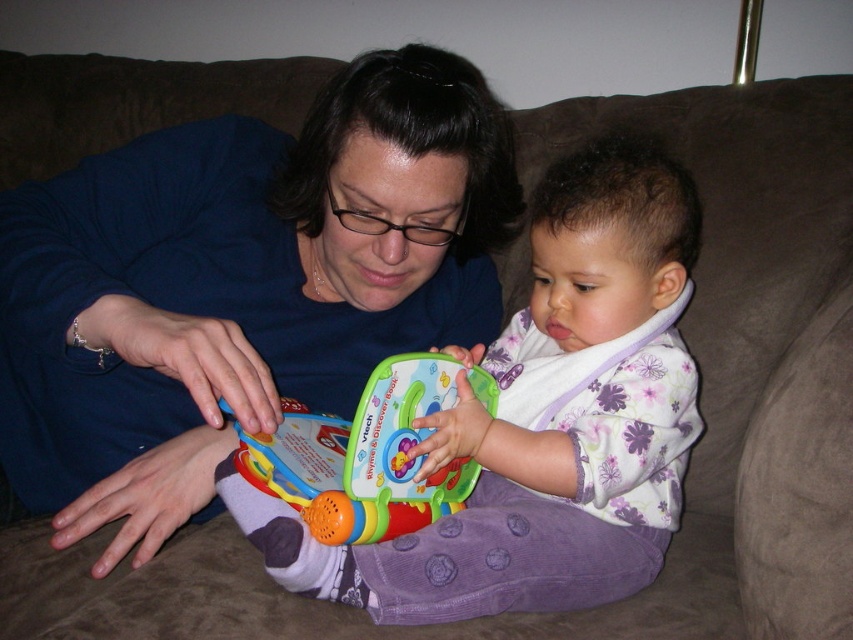
Question: Among these points, which one is nearest to the camera?

Choices:
 (A) (x=111, y=323)
 (B) (x=421, y=620)
 (C) (x=370, y=435)

Answer: (C)

Question: Which of the following is the closest to the observer?

Choices:
 (A) (328, 435)
 (B) (51, 381)
 (C) (613, 499)

Answer: (C)

Question: Which object is closer to the camera taking this photo?

Choices:
 (A) multicolored plastic toy at center
 (B) floral jersey at center
 (C) blue fabric at center

Answer: (C)

Question: Is floral jersey at center positioned in front of multicolored plastic toy at center?

Choices:
 (A) yes
 (B) no

Answer: (B)

Question: Can you confirm if blue fabric at center is positioned to the left of floral jersey at center?

Choices:
 (A) yes
 (B) no

Answer: (A)

Question: Is floral jersey at center below multicolored plastic toy at center?

Choices:
 (A) yes
 (B) no

Answer: (B)